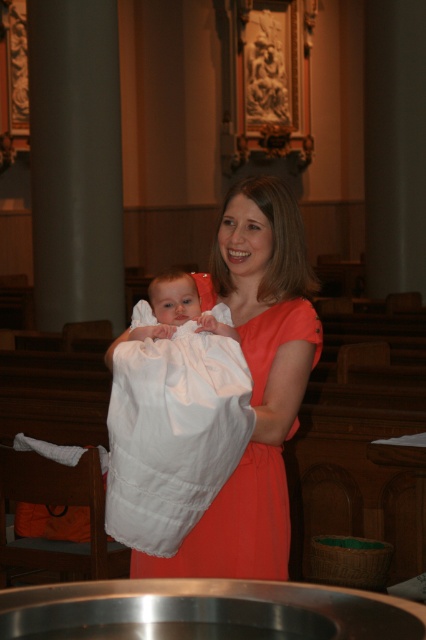
Consider the image. Is orange satin dress at center to the left of white soft cloth at center from the viewer's perspective?

In fact, orange satin dress at center is to the right of white soft cloth at center.

Which of these two, orange satin dress at center or white soft cloth at center, stands shorter?

With less height is white soft cloth at center.

From the picture: Who is more distant from viewer, (242, 490) or (175, 476)?

Point (242, 490)

Where is `orange satin dress at center`? This screenshot has height=640, width=426. orange satin dress at center is located at coordinates (256, 385).